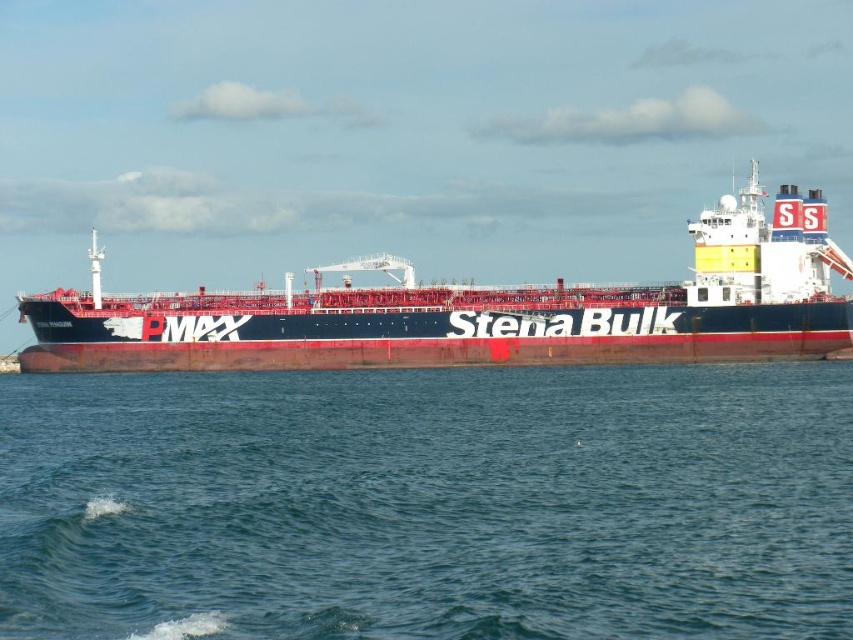
Question: Which of the following is the farthest from the observer?

Choices:
 (A) (483, 323)
 (B) (693, 531)

Answer: (A)

Question: Among these objects, which one is nearest to the camera?

Choices:
 (A) red matte ship at center
 (B) blue water at center

Answer: (B)

Question: From the image, what is the correct spatial relationship of blue water at center in relation to red matte ship at center?

Choices:
 (A) left
 (B) right

Answer: (B)

Question: Can you confirm if blue water at center is positioned to the right of red matte ship at center?

Choices:
 (A) yes
 (B) no

Answer: (A)

Question: Is blue water at center above red matte ship at center?

Choices:
 (A) yes
 (B) no

Answer: (B)